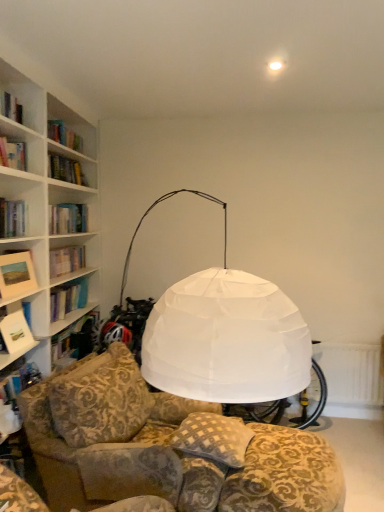
Question: Should I look upward or downward to see matte white picture frame at left?

Choices:
 (A) up
 (B) down

Answer: (B)

Question: Is checkered fabric pillow at center closer to camera compared to white textured radiator at lower right?

Choices:
 (A) no
 (B) yes

Answer: (B)

Question: Would you say checkered fabric pillow at center is a long distance from white textured radiator at lower right?

Choices:
 (A) no
 (B) yes

Answer: (B)

Question: Considering the relative sizes of checkered fabric pillow at center and white textured radiator at lower right in the image provided, is checkered fabric pillow at center smaller than white textured radiator at lower right?

Choices:
 (A) yes
 (B) no

Answer: (B)

Question: Would you say white textured radiator at lower right is part of checkered fabric pillow at center's contents?

Choices:
 (A) no
 (B) yes

Answer: (A)

Question: Is checkered fabric pillow at center not within white textured radiator at lower right?

Choices:
 (A) no
 (B) yes

Answer: (B)

Question: Is checkered fabric pillow at center oriented towards white textured radiator at lower right?

Choices:
 (A) yes
 (B) no

Answer: (B)

Question: Is matte white picture frame at left bigger than white paper book at left?

Choices:
 (A) yes
 (B) no

Answer: (A)

Question: Can you confirm if matte white picture frame at left is taller than white paper book at left?

Choices:
 (A) yes
 (B) no

Answer: (A)

Question: From a real-world perspective, is matte white picture frame at left located higher than white paper book at left?

Choices:
 (A) no
 (B) yes

Answer: (B)

Question: Is matte white picture frame at left at the right side of white paper book at left?

Choices:
 (A) no
 (B) yes

Answer: (B)

Question: Is matte white picture frame at left closer to the viewer compared to white paper book at left?

Choices:
 (A) yes
 (B) no

Answer: (A)

Question: From a real-world perspective, is matte white picture frame at left below white paper book at left?

Choices:
 (A) yes
 (B) no

Answer: (B)

Question: Is white paper book at left thinner than checkered fabric pillow at center?

Choices:
 (A) yes
 (B) no

Answer: (A)